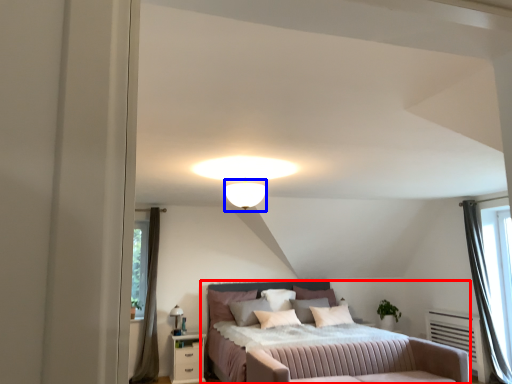
Question: Which object is closer to the camera taking this photo, bed (highlighted by a red box) or lighting (highlighted by a blue box)?

Choices:
 (A) bed
 (B) lighting

Answer: (B)